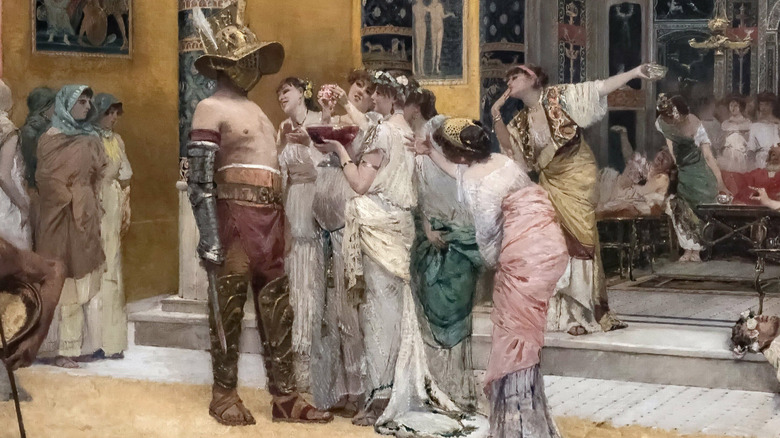
Locate an element on the screen. picture is located at coordinates (118, 51).